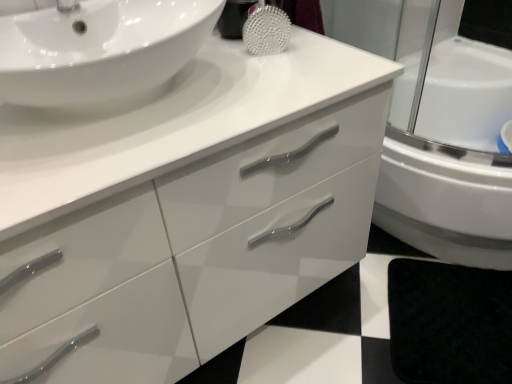
Question: Would you consider glossy white cabinet at center to be distant from black matte bath mat at lower right?

Choices:
 (A) yes
 (B) no

Answer: (B)

Question: Does glossy white cabinet at center have a smaller size compared to black matte bath mat at lower right?

Choices:
 (A) yes
 (B) no

Answer: (B)

Question: Can you confirm if glossy white cabinet at center is thinner than black matte bath mat at lower right?

Choices:
 (A) no
 (B) yes

Answer: (A)

Question: Is glossy white cabinet at center behind black matte bath mat at lower right?

Choices:
 (A) yes
 (B) no

Answer: (B)

Question: Is glossy white cabinet at center located outside black matte bath mat at lower right?

Choices:
 (A) yes
 (B) no

Answer: (A)

Question: Does point (250, 309) appear closer or farther from the camera than point (448, 306)?

Choices:
 (A) closer
 (B) farther

Answer: (A)

Question: Looking at the image, does glossy white cabinet at center seem bigger or smaller compared to black matte bath mat at lower right?

Choices:
 (A) small
 (B) big

Answer: (B)

Question: From their relative heights in the image, would you say glossy white cabinet at center is taller or shorter than black matte bath mat at lower right?

Choices:
 (A) tall
 (B) short

Answer: (A)

Question: From a real-world perspective, is glossy white cabinet at center positioned above or below black matte bath mat at lower right?

Choices:
 (A) above
 (B) below

Answer: (A)

Question: Relative to white glossy sink at upper left, is black matte bath mat at lower right in front or behind?

Choices:
 (A) front
 (B) behind

Answer: (B)

Question: Looking at their shapes, would you say black matte bath mat at lower right is wider or thinner than white glossy sink at upper left?

Choices:
 (A) wide
 (B) thin

Answer: (A)

Question: Considering the relative positions of black matte bath mat at lower right and white glossy sink at upper left in the image provided, is black matte bath mat at lower right to the left or to the right of white glossy sink at upper left?

Choices:
 (A) left
 (B) right

Answer: (B)

Question: In terms of height, does black matte bath mat at lower right look taller or shorter compared to white glossy sink at upper left?

Choices:
 (A) short
 (B) tall

Answer: (A)

Question: Is black matte bath mat at lower right situated inside glossy white cabinet at center or outside?

Choices:
 (A) inside
 (B) outside

Answer: (B)

Question: Considering the relative positions of black matte bath mat at lower right and glossy white cabinet at center in the image provided, is black matte bath mat at lower right to the left or to the right of glossy white cabinet at center?

Choices:
 (A) right
 (B) left

Answer: (A)